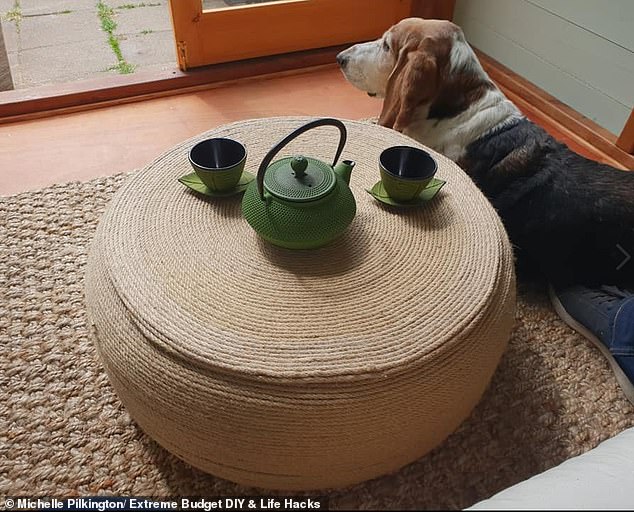
Locate an element on the screen. The height and width of the screenshot is (512, 634). door is located at coordinates (231, 36).